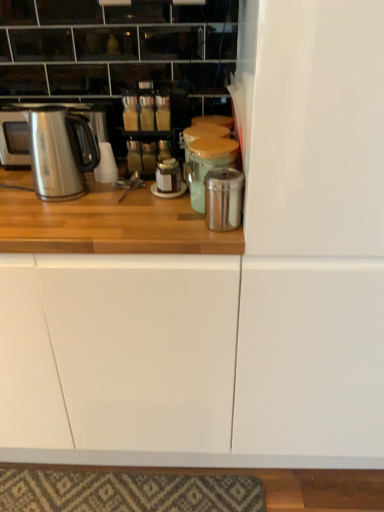
Question: Does metallic silver canister at center, the second appliance from the front, have a lesser width compared to metallic silver fridge at center-right?

Choices:
 (A) no
 (B) yes

Answer: (B)

Question: Is metallic silver canister at center, which is counted as the 1th appliance, starting from the back, smaller than metallic silver fridge at center-right?

Choices:
 (A) no
 (B) yes

Answer: (B)

Question: Does metallic silver canister at center, the second appliance from the front, turn towards metallic silver fridge at center-right?

Choices:
 (A) yes
 (B) no

Answer: (B)

Question: Is metallic silver canister at center, which is counted as the 1th appliance, starting from the back, in contact with metallic silver fridge at center-right?

Choices:
 (A) no
 (B) yes

Answer: (A)

Question: Is metallic silver canister at center, which is counted as the 1th appliance, starting from the back, oriented away from metallic silver fridge at center-right?

Choices:
 (A) no
 (B) yes

Answer: (A)

Question: From a real-world perspective, is shiny metallic canister at center, arranged as the first appliance when viewed from the front, physically located above or below metallic silver canister at center, the second appliance from the front?

Choices:
 (A) above
 (B) below

Answer: (B)

Question: Is point (208, 204) positioned closer to the camera than point (196, 204)?

Choices:
 (A) closer
 (B) farther

Answer: (A)

Question: Is shiny metallic canister at center, the 2th appliance viewed from the back, wider or thinner than metallic silver canister at center, the second appliance from the front?

Choices:
 (A) wide
 (B) thin

Answer: (B)

Question: Considering the positions of shiny metallic canister at center, arranged as the first appliance when viewed from the front, and metallic silver canister at center, which is counted as the 1th appliance, starting from the back, in the image, is shiny metallic canister at center, arranged as the first appliance when viewed from the front, bigger or smaller than metallic silver canister at center, which is counted as the 1th appliance, starting from the back,?

Choices:
 (A) big
 (B) small

Answer: (B)

Question: Would you say shiny metallic canister at center, the 2th appliance viewed from the back, is to the left or to the right of stainless steel kettle at left in the picture?

Choices:
 (A) right
 (B) left

Answer: (A)

Question: Considering the positions of shiny metallic canister at center, arranged as the first appliance when viewed from the front, and stainless steel kettle at left in the image, is shiny metallic canister at center, arranged as the first appliance when viewed from the front, taller or shorter than stainless steel kettle at left?

Choices:
 (A) short
 (B) tall

Answer: (A)

Question: Relative to stainless steel kettle at left, is shiny metallic canister at center, arranged as the first appliance when viewed from the front, in front or behind?

Choices:
 (A) front
 (B) behind

Answer: (A)

Question: Is point (241, 186) positioned closer to the camera than point (13, 117)?

Choices:
 (A) closer
 (B) farther

Answer: (A)

Question: Considering their positions, is stainless steel kettle at left located in front of or behind metallic silver canister at center, which is counted as the 1th appliance, starting from the back?

Choices:
 (A) behind
 (B) front

Answer: (A)

Question: Do you think stainless steel kettle at left is within metallic silver canister at center, the second appliance from the front, or outside of it?

Choices:
 (A) outside
 (B) inside

Answer: (A)